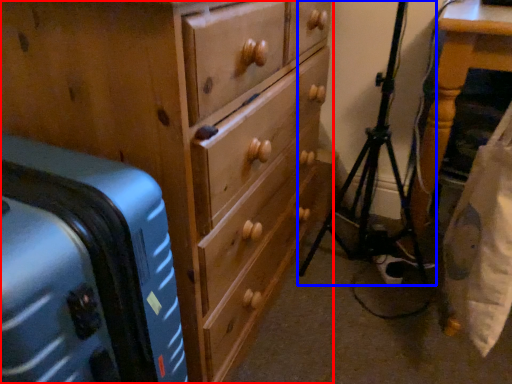
Question: Among these objects, which one is nearest to the camera, chest of drawers (highlighted by a red box) or tripod (highlighted by a blue box)?

Choices:
 (A) chest of drawers
 (B) tripod

Answer: (A)